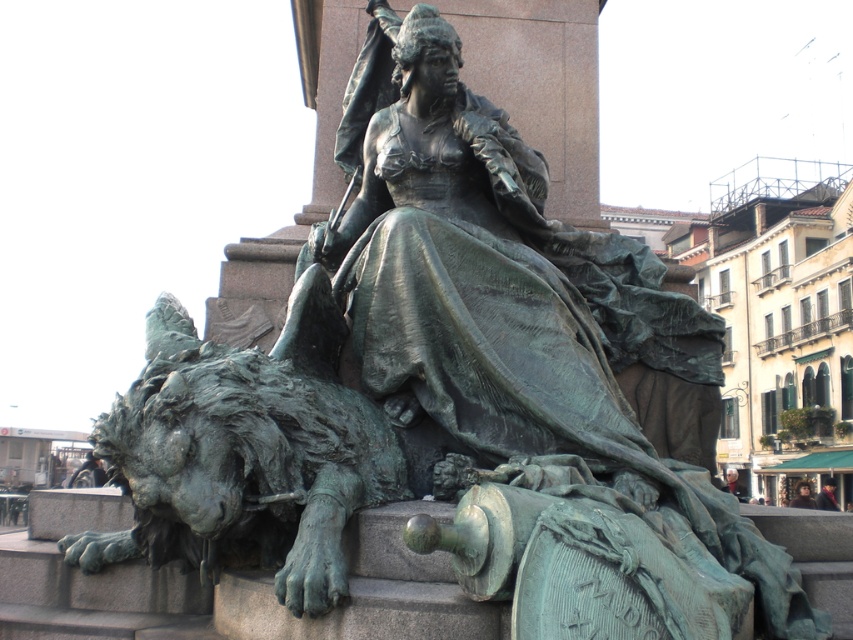
You are a city planner reviewing the layout of the public square. The statue must be placed exactly at the center coordinates of the square, which is at point 0.5, 0.5. Is the bronze statue at center currently positioned correctly?

The bronze statue at center is positioned at point (490, 284), which is slightly off from the required center coordinates of (426, 320). Therefore, it is not correctly placed.

You are an art student trying to sketch the scene. You need to ensure the proportions are accurate. Which object should you draw first to establish the scale, the bronze statue at center or the green patina stone lion at lower left?

The bronze statue at center should be drawn first to establish the scale since it is wider than the green patina stone lion at lower left.